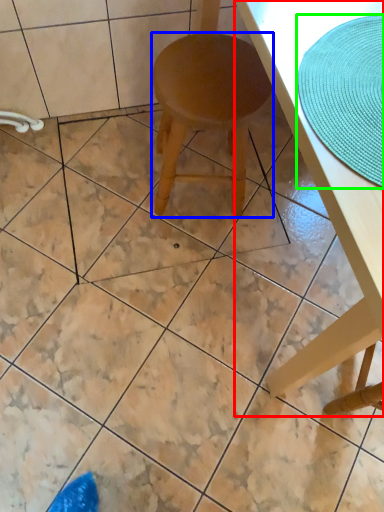
Question: Estimate the real-world distances between objects in this image. Which object is closer to table (highlighted by a red box), stool (highlighted by a blue box) or mat (highlighted by a green box)?

Choices:
 (A) stool
 (B) mat

Answer: (B)